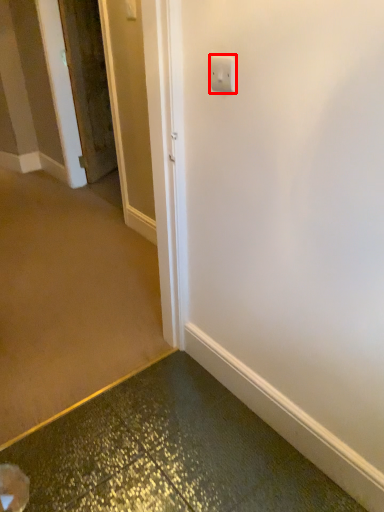
Question: Observing the image, what is the correct spatial positioning of light switch (annotated by the red box) in reference to door?

Choices:
 (A) left
 (B) right

Answer: (B)